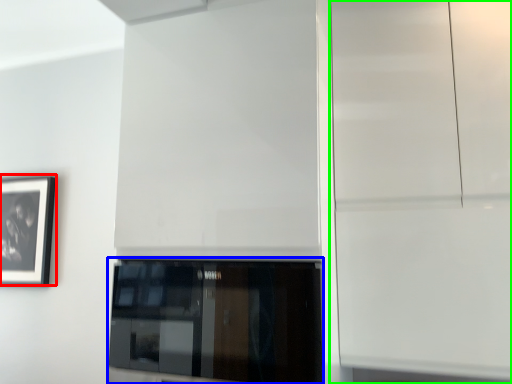
Question: Which object is positioned farthest from picture frame (highlighted by a red box)? Select from window (highlighted by a blue box) and glass door (highlighted by a green box).

Choices:
 (A) window
 (B) glass door

Answer: (B)